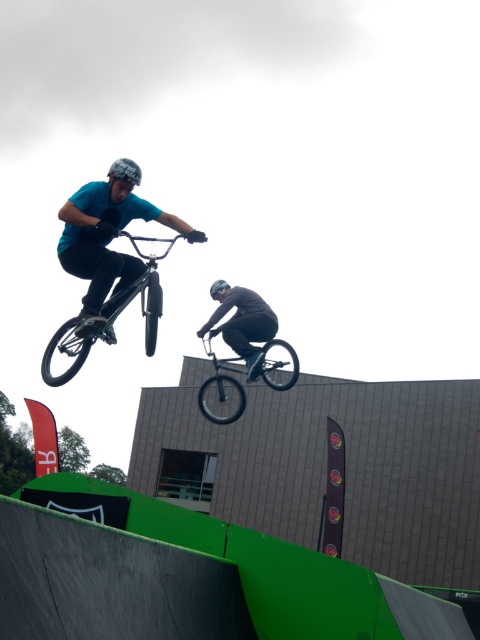
Please use the coordinate system where the bottom left corner is the origin. The shiny metallic bicycle at upper center is located at which coordinate?

The shiny metallic bicycle at upper center is located at coordinate point (111, 316).

You are a BMX stunt coordinator planning the next jump. You have two points marked on the ramp for landing zones. The first point is at coordinates point (x=156, y=307) and the second is at point (x=220, y=316). Which landing zone is closer to the ramp exit? Please answer based on their positions.

Point (x=156, y=307) is in front of point (x=220, y=316), so the landing zone at point (x=156, y=307) is closer to the ramp exit.

You are a photographer at the BMX event. You need to capture a photo where both the shiny metallic bicycle at upper center and the shiny black bicycle at center are visible. Based on their positions, which bicycle would appear higher in the photo?

The shiny metallic bicycle at upper center appears higher in the photo because it is positioned above the shiny black bicycle at center.